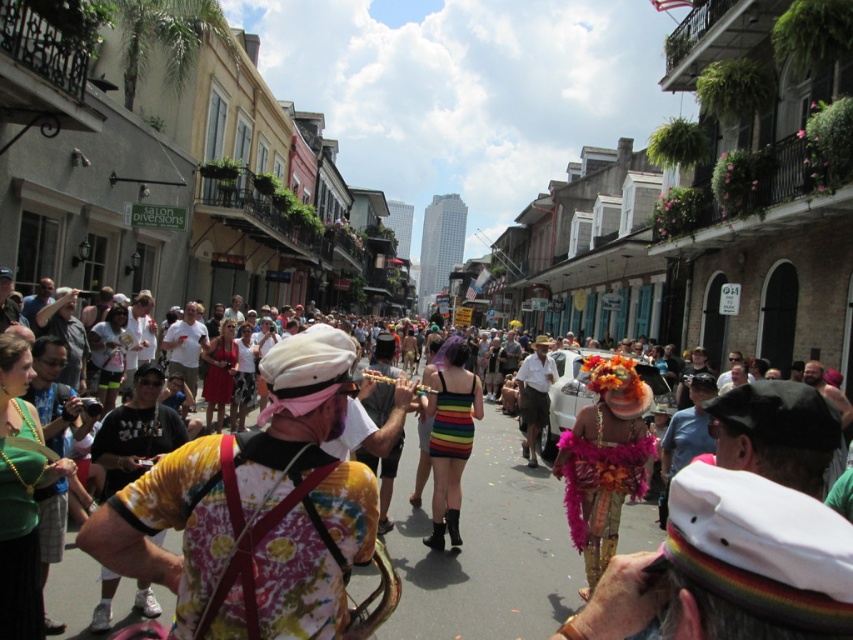
Question: Which object is closer to the camera taking this photo?

Choices:
 (A) tie-dye fabric saxophone at center
 (B) rainbow striped dress at center

Answer: (A)

Question: Is tie-dye fabric saxophone at center further to the viewer compared to rainbow striped dress at center?

Choices:
 (A) no
 (B) yes

Answer: (A)

Question: Among these objects, which one is nearest to the camera?

Choices:
 (A) rainbow striped dress at center
 (B) floral tie-dye shirt at center

Answer: (B)

Question: Among these objects, which one is farthest from the camera?

Choices:
 (A) rainbow striped dress at center
 (B) tie-dye fabric saxophone at center
 (C) floral tie-dye shirt at center

Answer: (A)

Question: Where is tie-dye fabric saxophone at center located in relation to floral tie-dye shirt at center in the image?

Choices:
 (A) right
 (B) left

Answer: (B)

Question: Can you confirm if tie-dye fabric saxophone at center is bigger than rainbow striped dress at center?

Choices:
 (A) yes
 (B) no

Answer: (A)